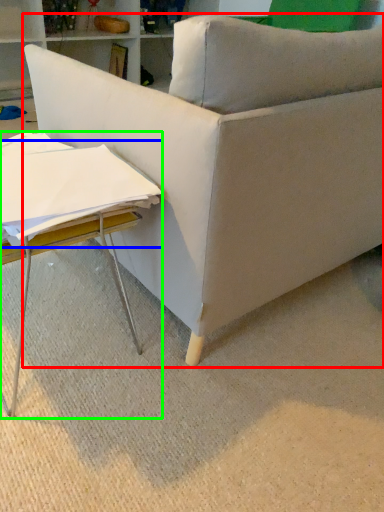
Question: Considering the real-world distances, which object is closest to studio couch (highlighted by a red box)? sheet (highlighted by a blue box) or table (highlighted by a green box).

Choices:
 (A) sheet
 (B) table

Answer: (B)